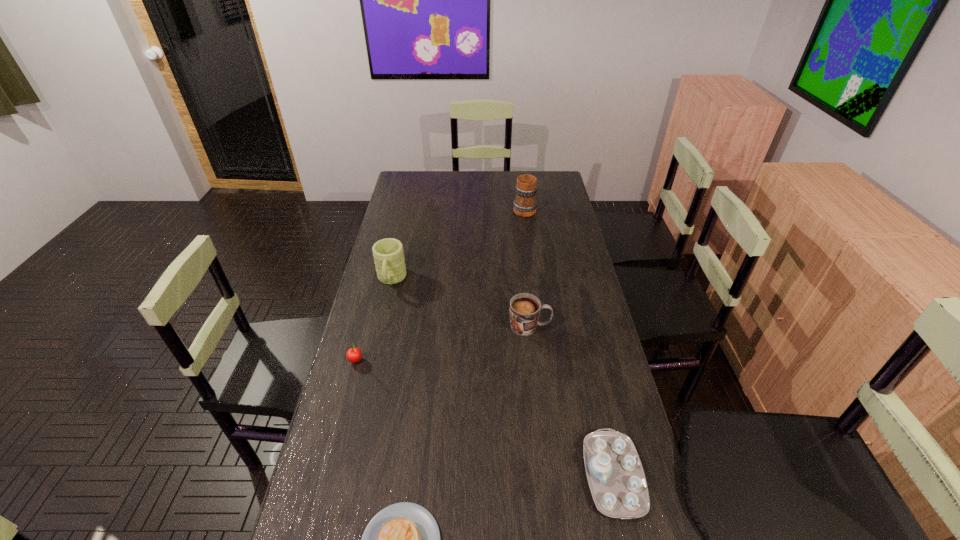
Locate which mug ranks second in proximity to the cherry. Please provide its 2D coordinates. Your answer should be formatted as a tuple, i.e. [(x, y)], where the tuple contains the x and y coordinates of a point satisfying the conditions above.

[(525, 308)]

Identify which mug is the closest to the shortest mug. Please provide its 2D coordinates. Your answer should be formatted as a tuple, i.e. [(x, y)], where the tuple contains the x and y coordinates of a point satisfying the conditions above.

[(388, 253)]

In order to click on vacant space that satisfies the following two spatial constraints: 1. on the side of the rightmost object with the handle; 2. on the right side of the nearest mug in this screenshot , I will do 547,476.

Find the location of `vacant space that satisfies the following two spatial constraints: 1. on the side of the third farthest object with the handle; 2. on the right side of the rightmost object`. vacant space that satisfies the following two spatial constraints: 1. on the side of the third farthest object with the handle; 2. on the right side of the rightmost object is located at coordinates click(x=547, y=476).

The width and height of the screenshot is (960, 540). What are the coordinates of `vacant region that satisfies the following two spatial constraints: 1. on the back side of the chinaware; 2. on the side of the nearest mug with the handle` in the screenshot? It's located at (579, 327).